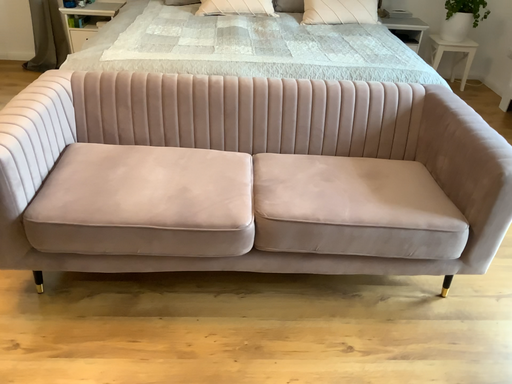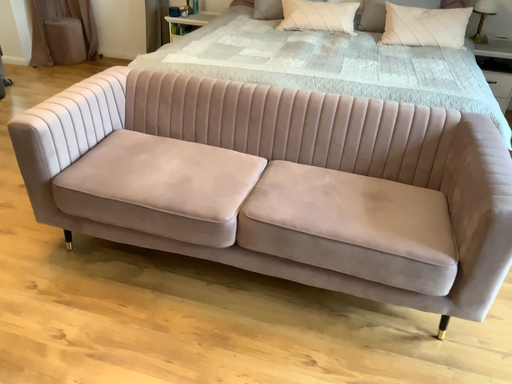
Question: Which way did the camera rotate in the video?

Choices:
 (A) rotated right
 (B) rotated left

Answer: (B)